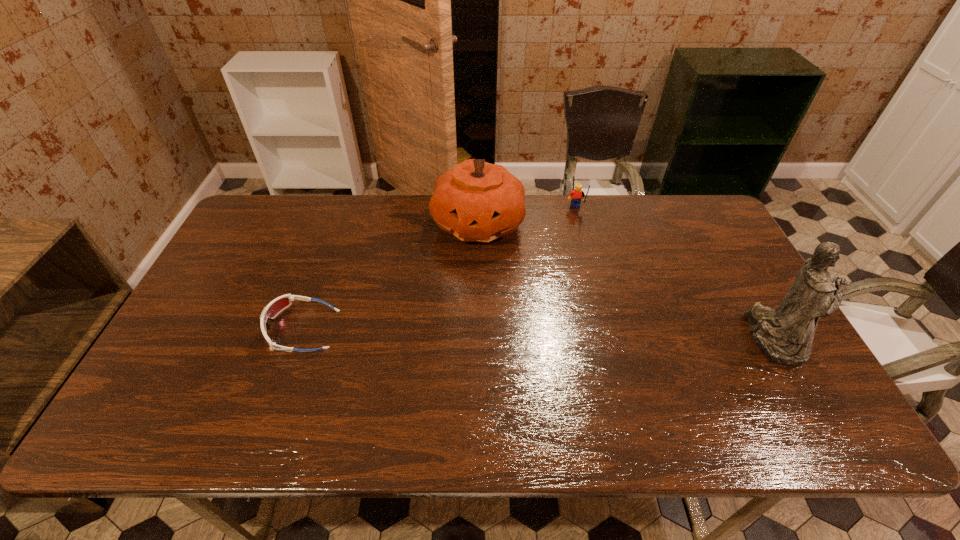
The image size is (960, 540). I want to click on the shortest object, so click(x=276, y=306).

Locate an element on the screen. The height and width of the screenshot is (540, 960). goggles is located at coordinates (276, 306).

You are a GUI agent. You are given a task and a screenshot of the screen. Output one action in this format:
    pyautogui.click(x=<x>, y=<y>)
    Task: Click on the tallest object
    
    Given the screenshot: What is the action you would take?
    pyautogui.click(x=785, y=335)

Locate an element on the screen. figurine is located at coordinates (785, 335).

The height and width of the screenshot is (540, 960). I want to click on the third shortest object, so click(x=476, y=201).

The height and width of the screenshot is (540, 960). Identify the location of the third object from right to left. (476, 201).

Find the location of a particular element. This screenshot has width=960, height=540. the second shortest object is located at coordinates (577, 194).

The image size is (960, 540). I want to click on Lego, so click(x=577, y=194).

Where is `free space located on the front-facing side of the leftmost object`? free space located on the front-facing side of the leftmost object is located at coordinates (230, 329).

The width and height of the screenshot is (960, 540). In order to click on vacant region located on the front-facing side of the leftmost object in this screenshot , I will do `click(207, 329)`.